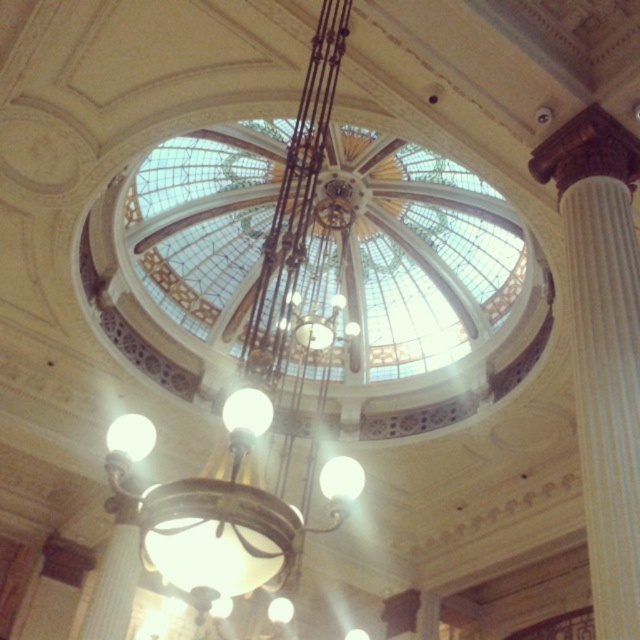
You are an interior designer planning to install a new lighting fixture in the space. You have a choice between a fixture that is 2 meters wide and another that is 1.5 meters wide. Given the existing metallic chandelier at center and the white marble column at right, which fixture size would you recommend to ensure it doesn

The metallic chandelier at center is wider than the white marble column at right. Since the existing chandelier is already larger in width, the 2 meter wide fixture would be appropriate as it maintains the scale of the space without overcrowding.

You are standing in the grand building and want to locate the point at coordinates point (252, 387). Where would you find this point?

The point at coordinates point (252, 387) is located on the metallic chandelier at center.

You are standing at point A located at coordinates point A at [264,369]. You want to walk to point B located at coordinates point B at 0.323, 0.586. The path between them is a straight line. Given that you can only move in straight lines and cannot teleport, will you be able to walk directly from point A to point B without any obstacles?

Yes, you can walk directly from point A to point B as there are no obstacles mentioned in the scene description between them.